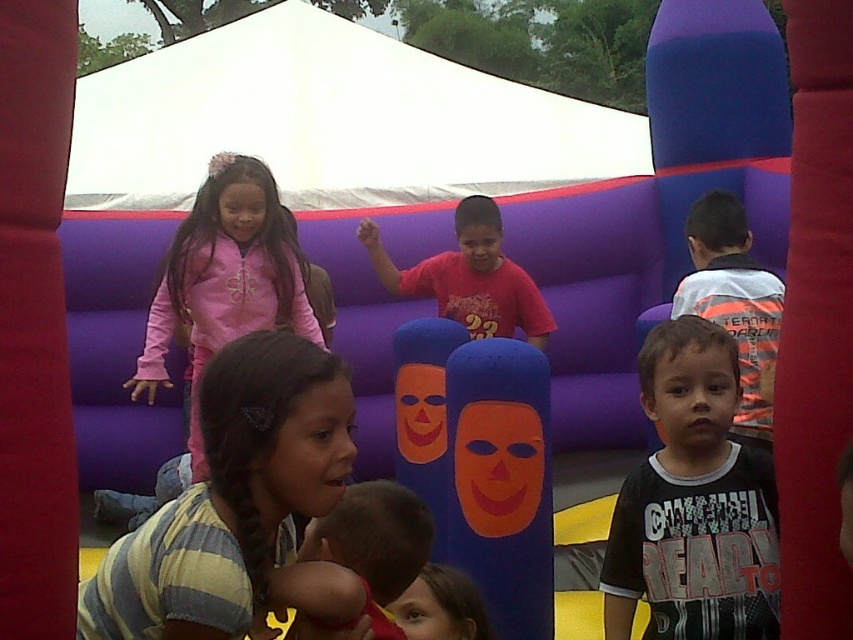
You are organizing a photo shoot and need to arrange two children wearing the striped cotton shirt at center and the pink fleece jacket at upper left. Which child should you place closer to the camera to ensure both appear the same size in the photo?

The striped cotton shirt at center has a lesser width compared to the pink fleece jacket at upper left, so you should place the child in the striped cotton shirt at center closer to the camera to make them appear the same size as the child in the pink fleece jacket at upper left.

You are organizing a group photo and need to arrange the striped cotton shirt at center and the matte red shirt at center side by side. Based on their sizes, which shirt should be placed on the left to ensure they fit within a 1.5 meter wide frame?

The striped cotton shirt at center has a lesser width compared to the matte red shirt at center, so placing the striped cotton shirt at center on the left and the matte red shirt at center on the right will utilize the space more efficiently within the 1.5 meter frame.